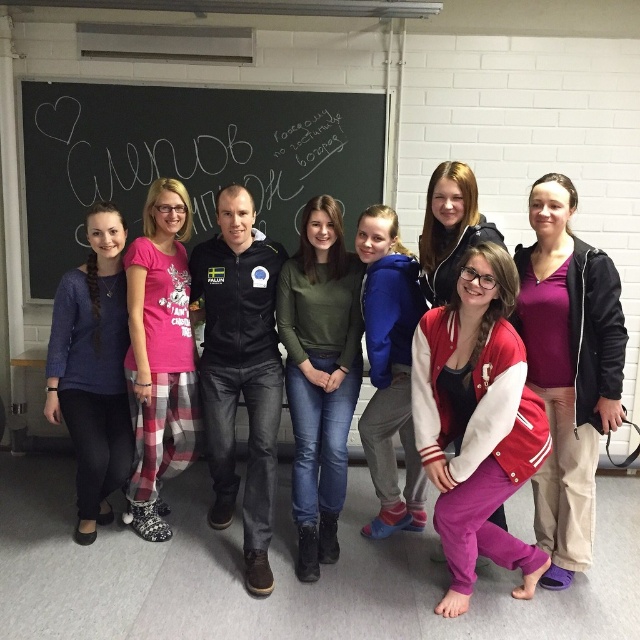
Which is more to the right, blue fleece jacket at center or matte black jacket at center?

Positioned to the right is matte black jacket at center.

Who is more forward, (420, 484) or (451, 280)?

Point (451, 280) is more forward.

The height and width of the screenshot is (640, 640). I want to click on blue fleece jacket at center, so (388, 369).

Between point (550, 563) and point (282, 273), which one is positioned behind?

The point (282, 273) is behind.

This screenshot has height=640, width=640. What are the coordinates of `purple soft sweater at center` in the screenshot? It's located at (568, 369).

Does black matte jacket at center have a smaller size compared to matte black jacket at center?

Actually, black matte jacket at center might be larger than matte black jacket at center.

Does black matte jacket at center have a lesser height compared to matte black jacket at center?

No, black matte jacket at center is not shorter than matte black jacket at center.

Measure the distance between point (209,276) and camera.

Point (209,276) and camera are 2.95 meters apart.

The image size is (640, 640). Find the location of `black matte jacket at center`. black matte jacket at center is located at coordinates (241, 371).